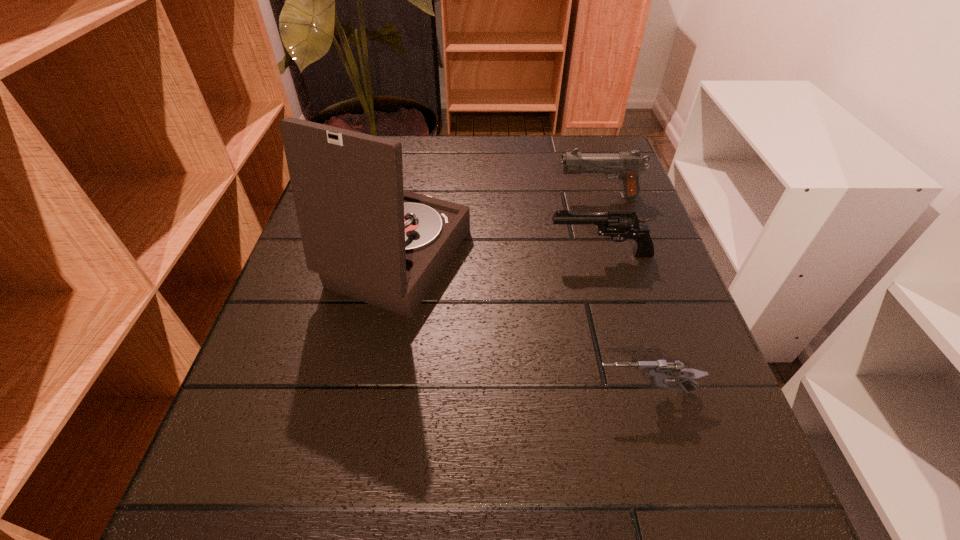
You are a GUI agent. You are given a task and a screenshot of the screen. Output one action in this format:
    pyautogui.click(x=<x>, y=<y>)
    Task: Click on the leftmost object
    
    Given the screenshot: What is the action you would take?
    pyautogui.click(x=367, y=238)

This screenshot has width=960, height=540. In order to click on phonograph record in this screenshot , I will do `click(367, 238)`.

This screenshot has width=960, height=540. In order to click on the farthest object in this screenshot , I will do `click(627, 165)`.

Where is `the second farthest gun`? This screenshot has width=960, height=540. the second farthest gun is located at coordinates (619, 225).

Where is `the shortest gun`? This screenshot has height=540, width=960. the shortest gun is located at coordinates (660, 370).

Locate an element on the screen. the nearest gun is located at coordinates pos(660,370).

Locate an element on the screen. vacant space located 0.090m on the right of the phonograph record is located at coordinates (516, 260).

This screenshot has width=960, height=540. I want to click on vacant space located 0.330m in the direction the farthest gun is aimed, so click(x=412, y=195).

Identify the location of free space located in the direction the farthest gun is aimed. (482, 195).

You are a GUI agent. You are given a task and a screenshot of the screen. Output one action in this format:
    pyautogui.click(x=<x>, y=<y>)
    Task: Click on the vacant space located 0.320m in the direction the farthest gun is aimed
    The height and width of the screenshot is (540, 960).
    Given the screenshot: What is the action you would take?
    pyautogui.click(x=417, y=195)